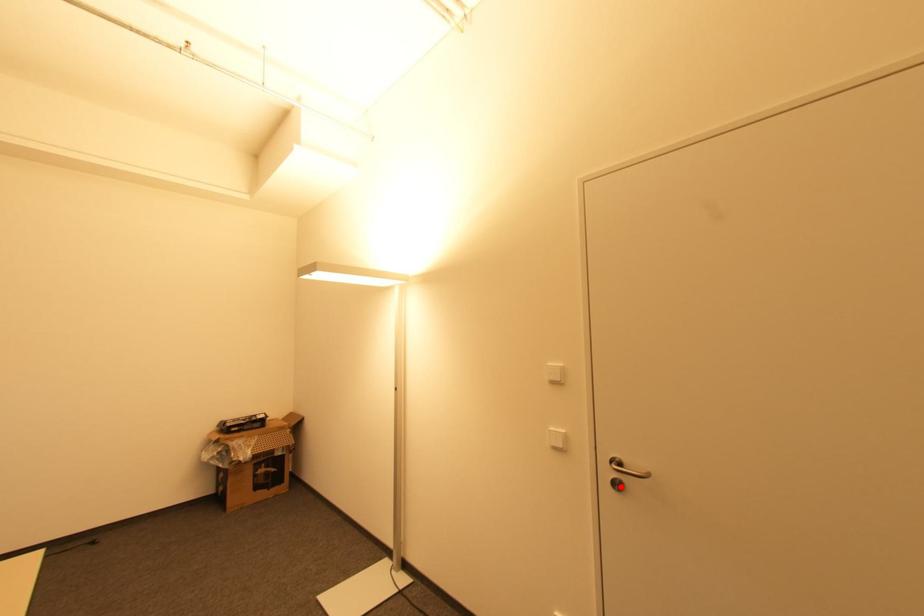
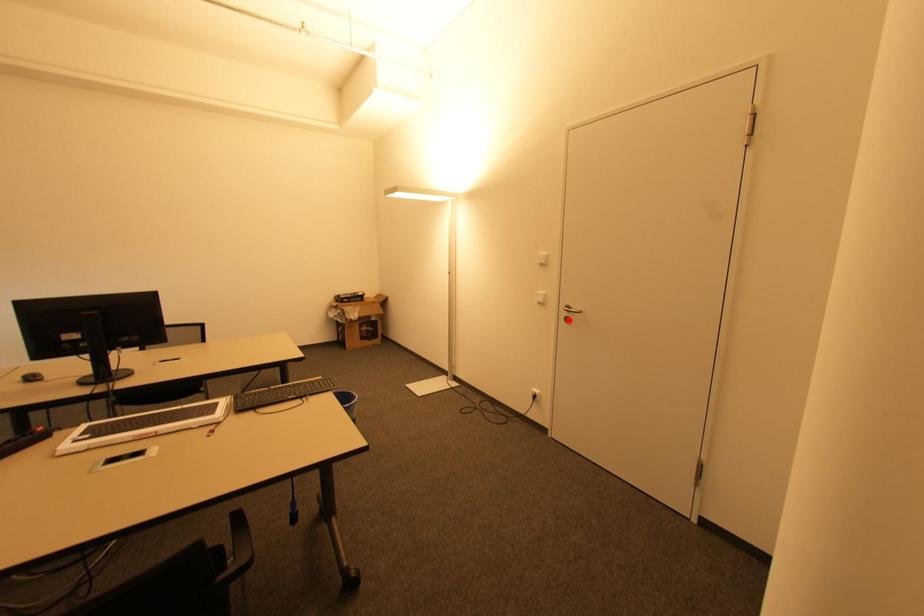
I am providing you with two images of the same scene from different viewpoints. A red point is marked on the first image and another point is marked on the second image. Does the point marked in image1 correspond to the same location as the one in image2?

Yes